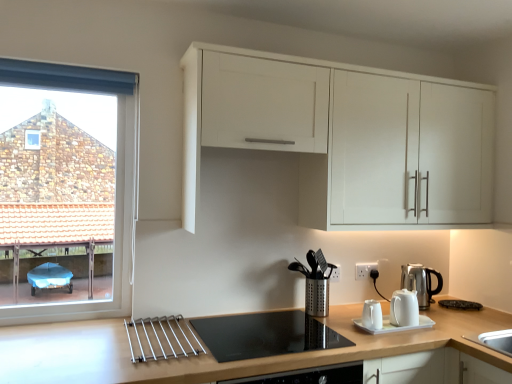
Question: From the image's perspective, relative to silver metallic kettle at right, which appears as the first kitchen appliance when viewed from the back, is white plastic electric outlet at lower right above or below?

Choices:
 (A) below
 (B) above

Answer: (B)

Question: From a real-world perspective, is white plastic electric outlet at lower right above or below silver metallic kettle at right, which is the 2th kitchen appliance in left-to-right order?

Choices:
 (A) above
 (B) below

Answer: (A)

Question: Estimate the real-world distances between objects in this image. Which object is closer to the black glass cooktop at center?

Choices:
 (A) silver metallic coffee machine at center
 (B) white matte cabinet at upper center
 (C) white plastic electric outlet at lower right
 (D) clear glass window at left
 (E) silver metallic kettle at right, arranged as the first kitchen appliance when viewed from the right

Answer: (A)

Question: Which is farther from the silver metallic kettle at right, which appears as the first kitchen appliance when viewed from the back?

Choices:
 (A) silver metallic coffee machine at center
 (B) black glass cooktop at center
 (C) white glossy teapot at center, the first kitchen appliance from the left
 (D) white plastic electric outlet at lower right
 (E) light brown wood at lower center

Answer: (B)